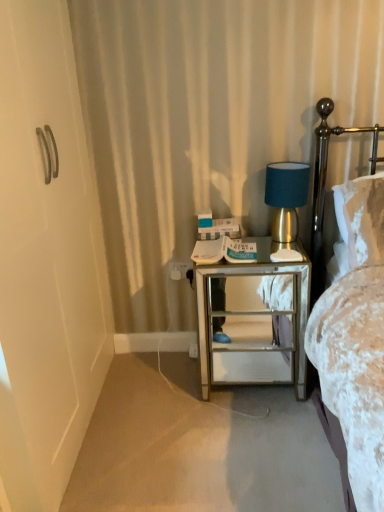
Question: From their relative heights in the image, would you say gold metallic headboard at right is taller or shorter than white plastic electric outlet at center?

Choices:
 (A) tall
 (B) short

Answer: (A)

Question: Is gold metallic headboard at right wider or thinner than white plastic electric outlet at center?

Choices:
 (A) thin
 (B) wide

Answer: (B)

Question: Which of these objects is positioned closest to the clear glass nightstand at center?

Choices:
 (A) gold metallic table lamp at right
 (B) white plastic electric outlet at center
 (C) carpet at lower left
 (D) gold metallic headboard at right

Answer: (A)

Question: Considering the real-world distances, which object is closest to the gold metallic headboard at right?

Choices:
 (A) carpet at lower left
 (B) white plastic electric outlet at center
 (C) gold metallic table lamp at right
 (D) clear glass nightstand at center

Answer: (C)